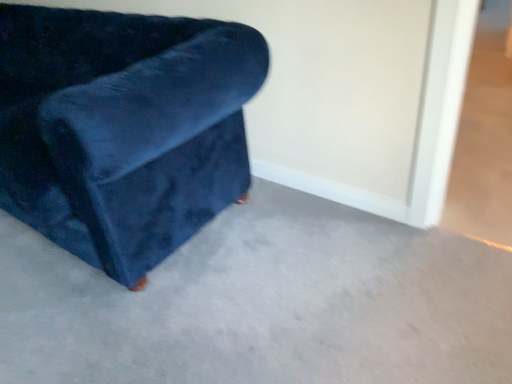
Question: Considering the relative positions of velvet blue chair at left and velvet blue couch at left in the image provided, is velvet blue chair at left to the left or to the right of velvet blue couch at left?

Choices:
 (A) right
 (B) left

Answer: (B)

Question: Is velvet blue chair at left wider or thinner than velvet blue couch at left?

Choices:
 (A) wide
 (B) thin

Answer: (B)

Question: From the image's perspective, is velvet blue chair at left positioned above or below velvet blue couch at left?

Choices:
 (A) below
 (B) above

Answer: (B)

Question: Relative to velvet blue chair at left, is velvet blue couch at left in front or behind?

Choices:
 (A) behind
 (B) front

Answer: (B)

Question: From a real-world perspective, relative to velvet blue chair at left, is velvet blue couch at left vertically above or below?

Choices:
 (A) above
 (B) below

Answer: (B)

Question: Do you think velvet blue couch at left is within velvet blue chair at left, or outside of it?

Choices:
 (A) inside
 (B) outside

Answer: (B)

Question: From the image's perspective, is velvet blue couch at left positioned above or below velvet blue chair at left?

Choices:
 (A) below
 (B) above

Answer: (A)